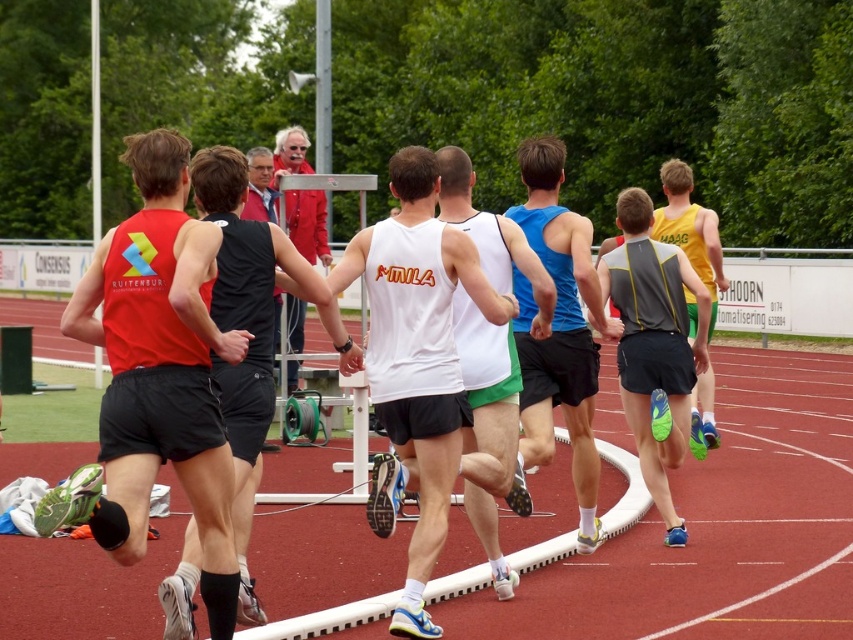
Which is behind, point (180, 557) or point (291, 301)?

The point (291, 301) is more distant.

Which of these two, matte black tank top at center or red jacket at upper center, stands taller?

With more height is red jacket at upper center.

Does point (236, 365) come closer to viewer compared to point (283, 132)?

That is True.

Locate an element on the screen. matte black tank top at center is located at coordinates (247, 314).

Does blue matte tank top at center appear over red jacket at upper center?

Actually, blue matte tank top at center is below red jacket at upper center.

Find the location of `blue matte tank top at center`. blue matte tank top at center is located at coordinates (558, 330).

Which is behind, point (563, 273) or point (285, 141)?

Point (285, 141)

Where is `blue matte tank top at center`? The image size is (853, 640). blue matte tank top at center is located at coordinates (558, 330).

Does gray/yellow mesh vest at center have a larger size compared to red jacket at upper center?

Incorrect, gray/yellow mesh vest at center is not larger than red jacket at upper center.

Who is more forward, (637, 429) or (291, 212)?

Point (637, 429)

Where is `gray/yellow mesh vest at center`? This screenshot has width=853, height=640. gray/yellow mesh vest at center is located at coordinates (654, 346).